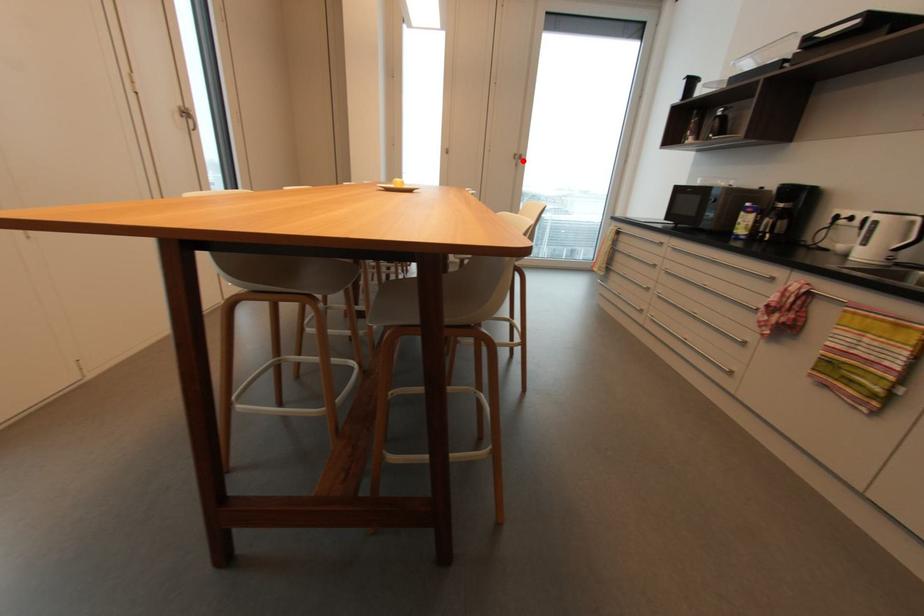
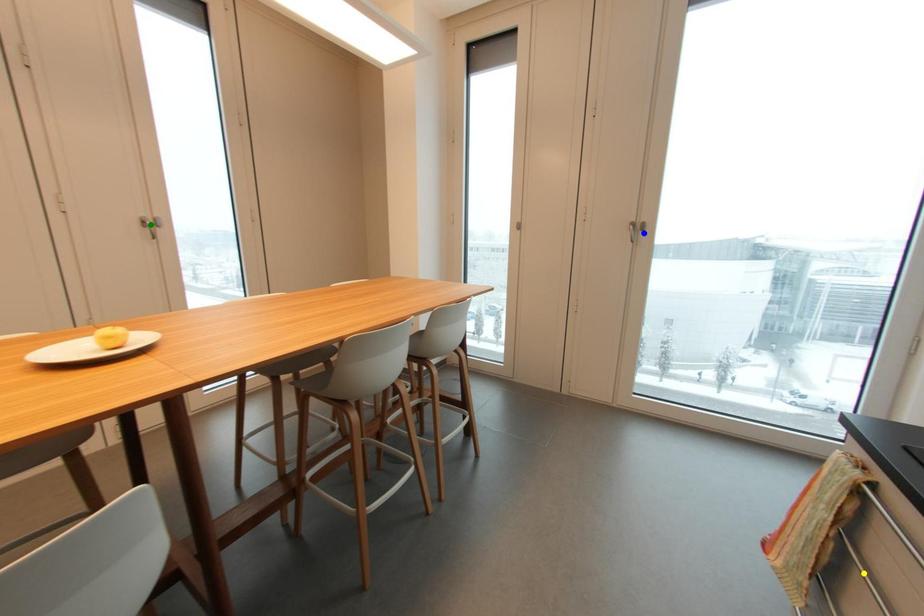
Question: I am providing you with two images of the same scene from different viewpoints. A red point is marked on the first image. You are given multiple points on the second image. In image 2, which mark is for the same physical point as the one in image 1?

Choices:
 (A) blue point
 (B) yellow point
 (C) green point

Answer: (A)